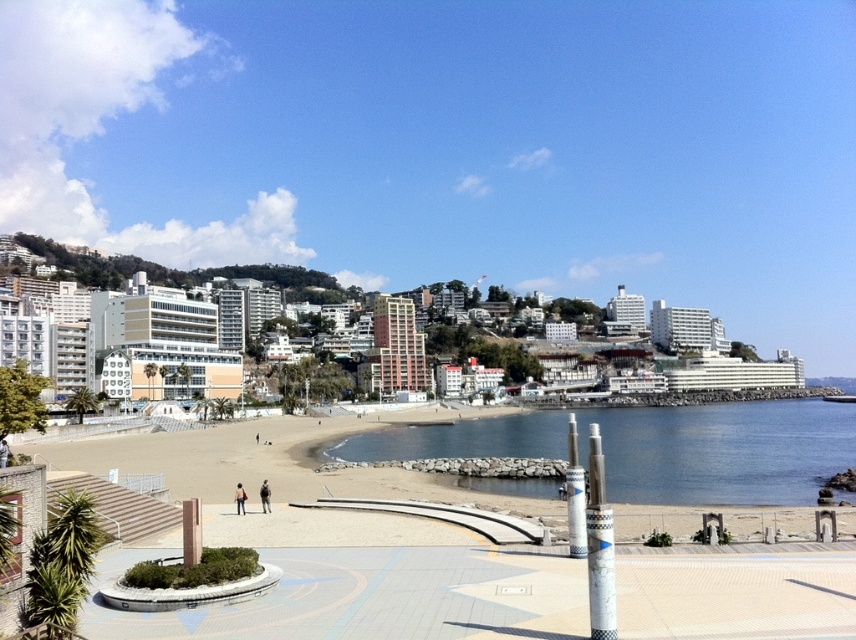
You are planning to take a photo of the coastal view. The scene includes a clear blue water at center and a green grassy hillside at upper center. Which of these two elements should you focus on if you want to capture the larger subject in your shot?

The green grassy hillside at upper center is larger in size compared to the clear blue water at center, so focusing on it would capture the larger subject.